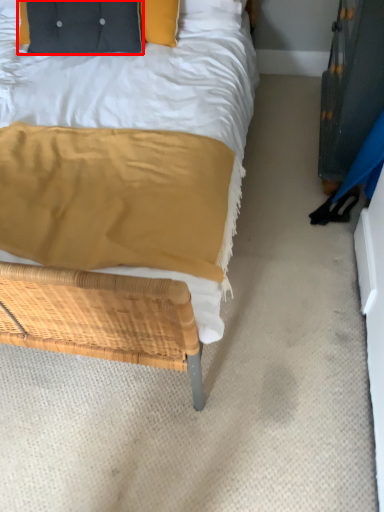
Question: From the image's perspective, where is pillow (annotated by the red box) located in relation to dresser in the image?

Choices:
 (A) below
 (B) above

Answer: (B)